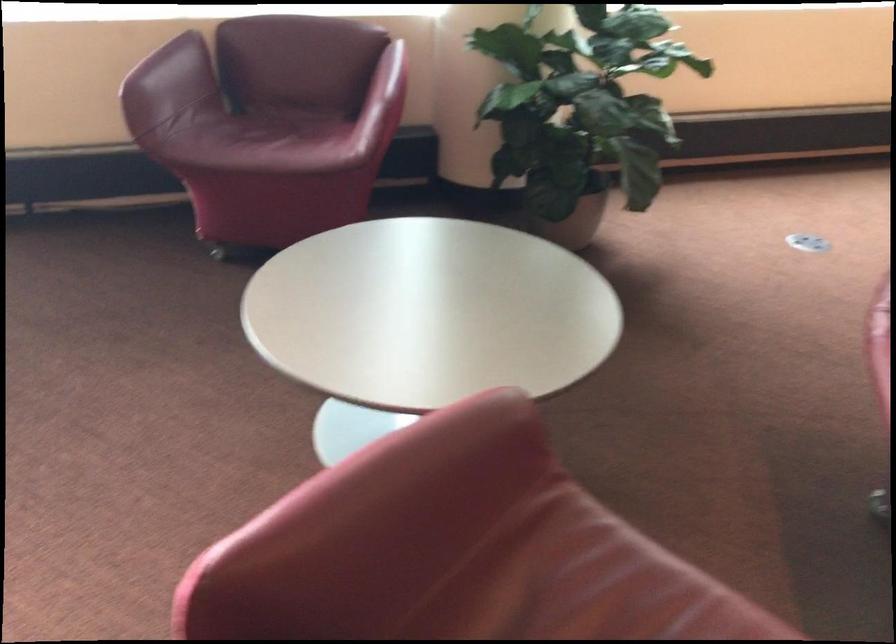
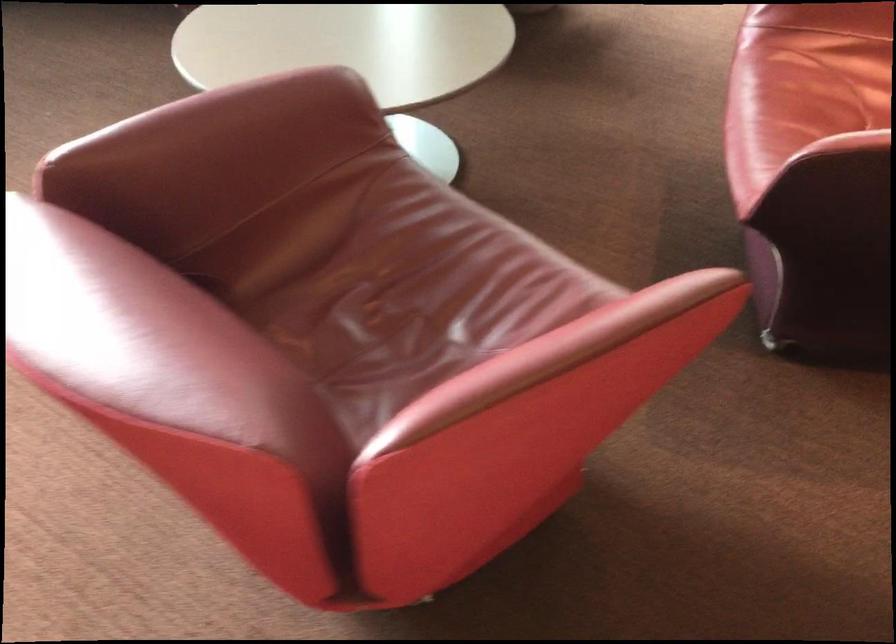
Where in the second image is the point corresponding to point (426, 489) from the first image?

(255, 118)